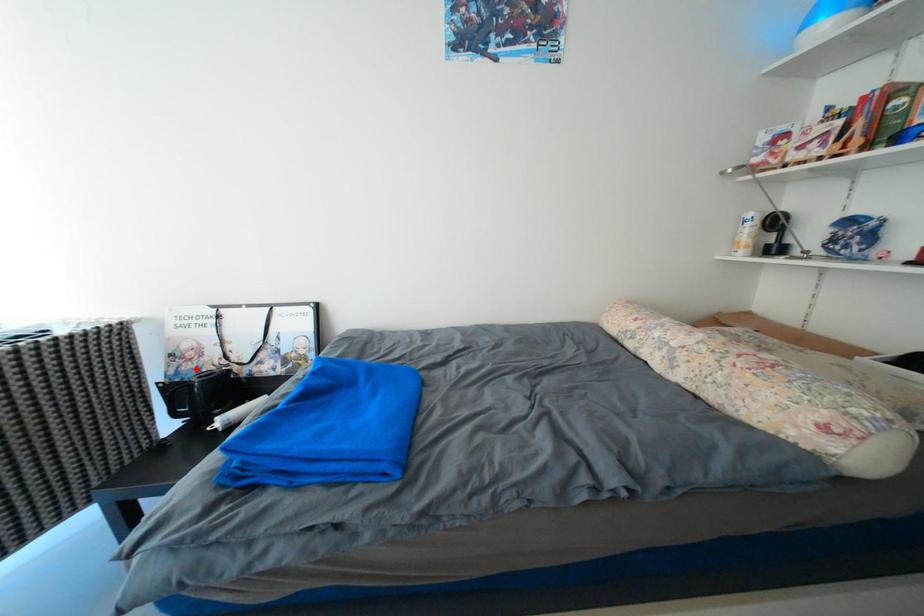
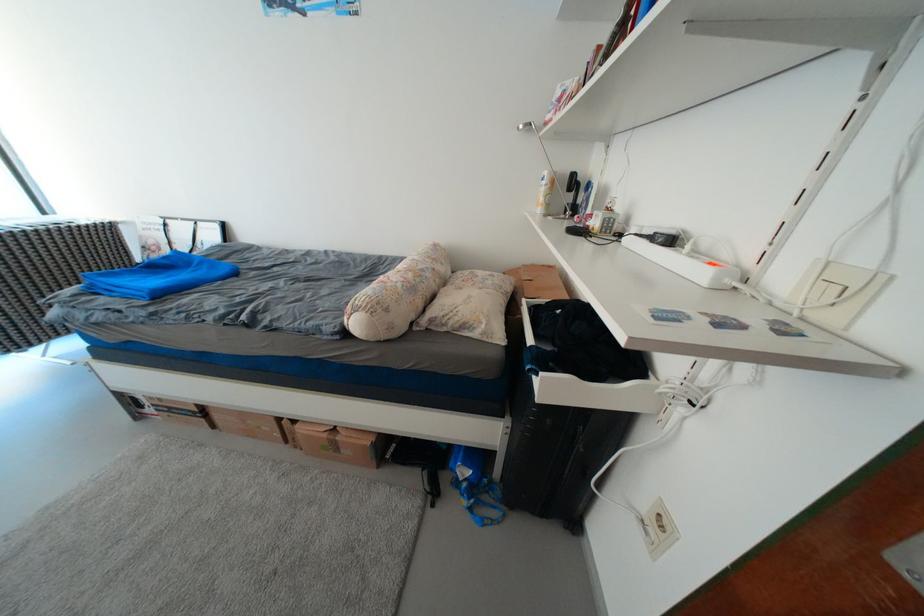
Where in the second image is the point corresponding to the highlighted location from the first image?

(163, 257)